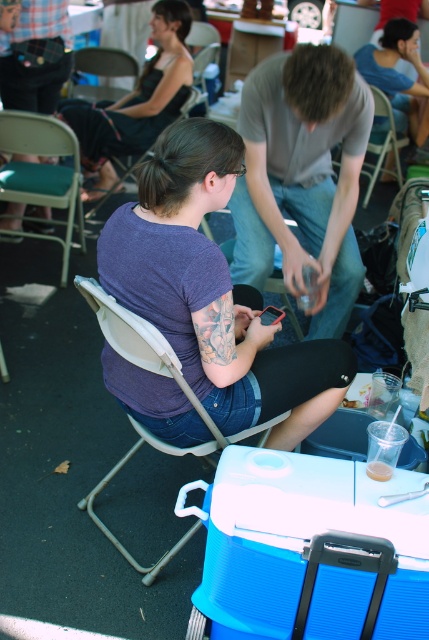
Question: Can you confirm if matte black shirt at center is positioned to the right of metallic silver chair at center?

Choices:
 (A) no
 (B) yes

Answer: (A)

Question: Which of the following is the closest to the observer?

Choices:
 (A) (343, 145)
 (B) (195, 228)
 (C) (69, 80)

Answer: (B)

Question: Which point appears closest to the camera in this image?

Choices:
 (A) (129, 60)
 (B) (416, 593)

Answer: (B)

Question: Among these points, which one is farthest from the camera?

Choices:
 (A) (79, 88)
 (B) (75, 280)
 (C) (389, 58)

Answer: (C)

Question: Is gray cotton shirt at center in front of matte blue shirt at upper center?

Choices:
 (A) no
 (B) yes

Answer: (B)

Question: Does purple matte shirt at center lie behind blue plastic cooler at lower right?

Choices:
 (A) yes
 (B) no

Answer: (A)